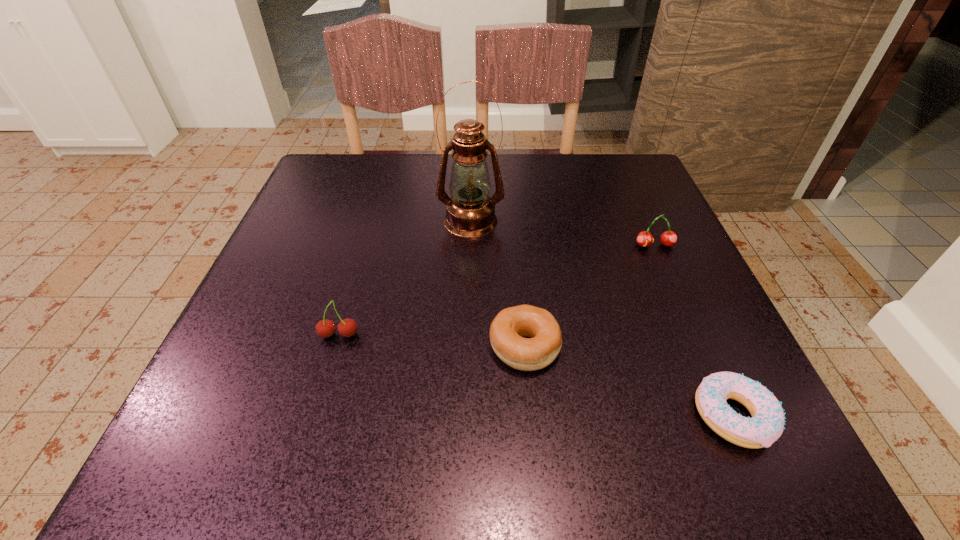
Locate an element on the screen. the tallest object is located at coordinates (470, 212).

Locate an element on the screen. Image resolution: width=960 pixels, height=540 pixels. the farthest object is located at coordinates (470, 212).

The height and width of the screenshot is (540, 960). In order to click on the nearer cherry in this screenshot , I will do `click(326, 328)`.

The height and width of the screenshot is (540, 960). I want to click on the leftmost object, so click(x=326, y=328).

Where is `the second farthest object`? The image size is (960, 540). the second farthest object is located at coordinates (669, 238).

At what (x,y) coordinates should I click in order to perform the action: click on the farther cherry. Please return your answer as a coordinate pair (x, y). Looking at the image, I should click on (669, 238).

Identify the location of bagel. This screenshot has width=960, height=540. (508, 328).

Image resolution: width=960 pixels, height=540 pixels. Find the location of `doughnut`. doughnut is located at coordinates (767, 423).

Locate an element on the screen. The height and width of the screenshot is (540, 960). vacant region located 0.220m on the right of the oil lamp is located at coordinates click(x=606, y=221).

At what (x,y) coordinates should I click in order to perform the action: click on vacant region located on the surface of the left cherry. Please return your answer as a coordinate pair (x, y). Looking at the image, I should click on (309, 437).